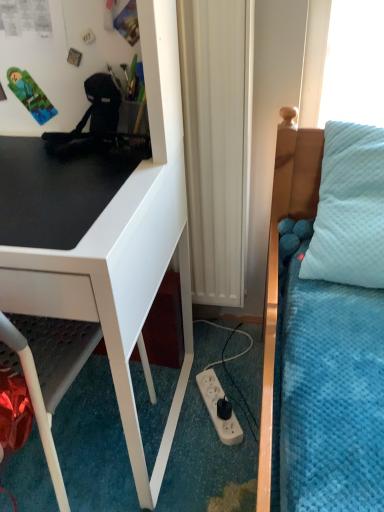
Question: Looking at the image, does white glossy desk at left seem bigger or smaller compared to white matte radiator at center?

Choices:
 (A) big
 (B) small

Answer: (A)

Question: Relative to white matte radiator at center, is white glossy desk at left in front or behind?

Choices:
 (A) front
 (B) behind

Answer: (A)

Question: Which object is positioned closest to the black matte desk at left?

Choices:
 (A) white plastic power outlet at lower center
 (B) white matte radiator at center
 (C) white glossy desk at left

Answer: (C)

Question: Based on their relative distances, which object is nearer to the black matte desk at left?

Choices:
 (A) white glossy desk at left
 (B) white matte radiator at center
 (C) white plastic power outlet at lower center

Answer: (A)